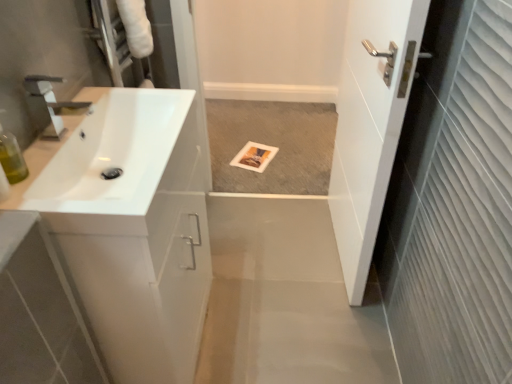
Question: Is white glossy door at right wider or thinner than translucent green bottle at left?

Choices:
 (A) wide
 (B) thin

Answer: (A)

Question: Is white glossy door at right taller or shorter than translucent green bottle at left?

Choices:
 (A) tall
 (B) short

Answer: (A)

Question: Which is nearer to the white glossy sink at left?

Choices:
 (A) white glossy sink at left
 (B) white glossy door at right
 (C) translucent green bottle at left

Answer: (A)

Question: Which is nearer to the white glossy door at right?

Choices:
 (A) white glossy sink at left
 (B) translucent green bottle at left
 (C) white glossy sink at left

Answer: (C)